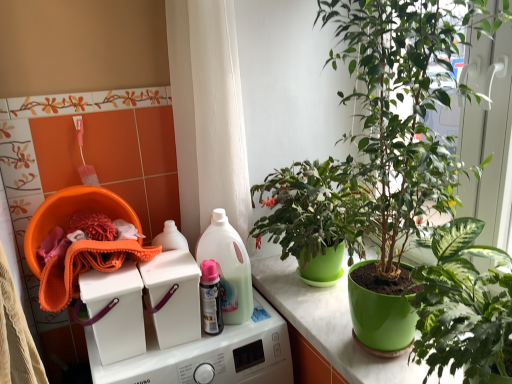
At what (x,y) coordinates should I click in order to perform the action: click on vacant area that is in front of translucent plastic bottle at center. Please return your answer as a coordinate pair (x, y). The width and height of the screenshot is (512, 384). Looking at the image, I should click on 218,339.